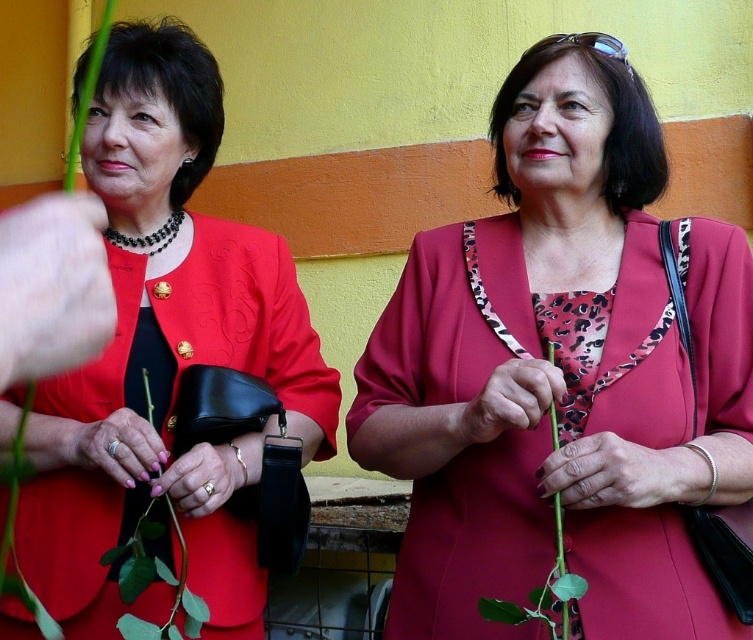
Is the position of matte black dress at left more distant than that of green matte plant at center?

Yes, it is.

Is point (312, 352) behind point (188, 618)?

Yes, it is.

At what (x,y) coordinates should I click in order to perform the action: click on matte black dress at left. Please return your answer as a coordinate pair (x, y). Image resolution: width=753 pixels, height=640 pixels. Looking at the image, I should click on (166, 355).

Between matte red dress at center and matte black dress at left, which one is positioned higher?

matte black dress at left is higher up.

Between point (697, 284) and point (203, 112), which one is positioned in front?

Point (697, 284)

What do you see at coordinates (562, 372) in the screenshot? I see `matte red dress at center` at bounding box center [562, 372].

Locate an element on the screen. The width and height of the screenshot is (753, 640). matte red dress at center is located at coordinates (562, 372).

Between point (142, 636) and point (169, 291), which one is positioned behind?

The point (169, 291) is more distant.

Does green matte plant at center have a lesser width compared to green matte flower at center?

No, green matte plant at center is not thinner than green matte flower at center.

Locate an element on the screen. green matte plant at center is located at coordinates (154, 579).

Identify the location of green matte plant at center. (154, 579).